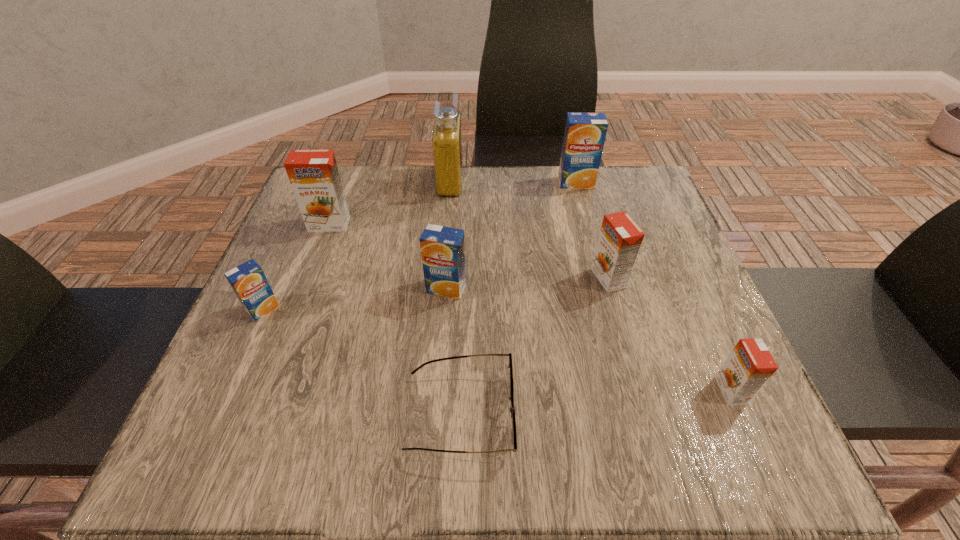
Select which object appears as the third closest to the second smallest orange orange juice. Please provide its 2D coordinates. Your answer should be formatted as a tuple, i.e. [(x, y)], where the tuple contains the x and y coordinates of a point satisfying the conditions above.

[(442, 248)]

Locate which object is the third closest to the second nearest orange orange juice. Please provide its 2D coordinates. Your answer should be formatted as a tuple, i.e. [(x, y)], where the tuple contains the x and y coordinates of a point satisfying the conditions above.

[(442, 248)]

Locate which orange juice is the fourth closest to the biggest orange orange juice. Please provide its 2D coordinates. Your answer should be formatted as a tuple, i.e. [(x, y)], where the tuple contains the x and y coordinates of a point satisfying the conditions above.

[(620, 238)]

Identify which orange juice is the closest to the perfume. Please provide its 2D coordinates. Your answer should be formatted as a tuple, i.e. [(x, y)], where the tuple contains the x and y coordinates of a point satisfying the conditions above.

[(313, 174)]

Select which blue orange_juice is the third closest to the tallest object. Please provide its 2D coordinates. Your answer should be formatted as a tuple, i.e. [(x, y)], where the tuple contains the x and y coordinates of a point satisfying the conditions above.

[(248, 281)]

Locate which blue orange_juice is the second closest to the third orange juice from left to right. Please provide its 2D coordinates. Your answer should be formatted as a tuple, i.e. [(x, y)], where the tuple contains the x and y coordinates of a point satisfying the conditions above.

[(585, 133)]

Locate which orange orange juice ranks second in proximity to the spectacles. Please provide its 2D coordinates. Your answer should be formatted as a tuple, i.e. [(x, y)], where the tuple contains the x and y coordinates of a point satisfying the conditions above.

[(750, 365)]

Locate an element on the screen. This screenshot has width=960, height=540. the closest orange orange juice to the second smallest blue orange_juice is located at coordinates (313, 174).

At what (x,y) coordinates should I click in order to perform the action: click on free space in the image that satisfies the following two spatial constraints: 1. on the front side of the second biggest blue orange_juice; 2. on the right side of the farthest orange orange juice. Please return your answer as a coordinate pair (x, y). The height and width of the screenshot is (540, 960). Looking at the image, I should click on (305, 288).

Locate an element on the screen. free space that satisfies the following two spatial constraints: 1. on the front side of the biggest blue orange_juice; 2. on the face of the spectacles is located at coordinates (636, 414).